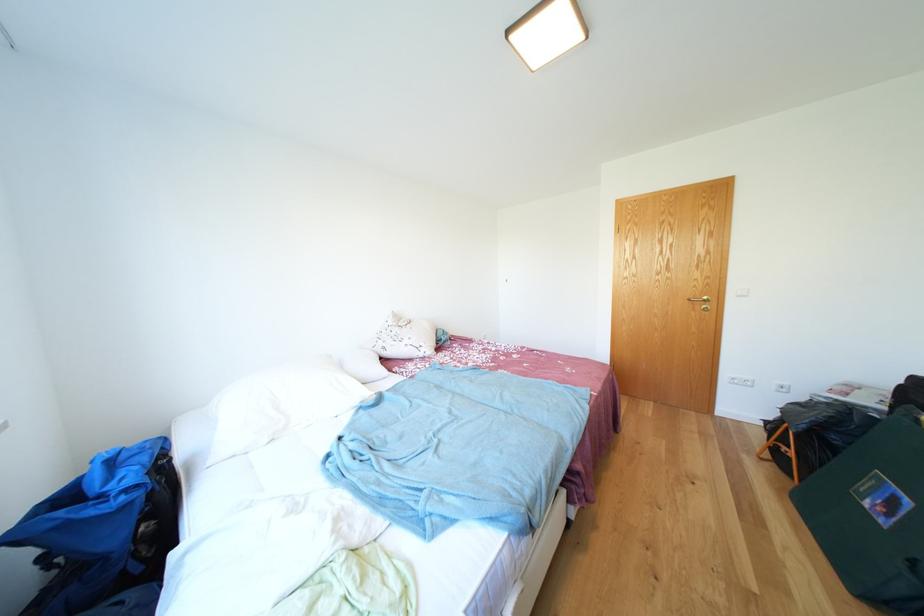
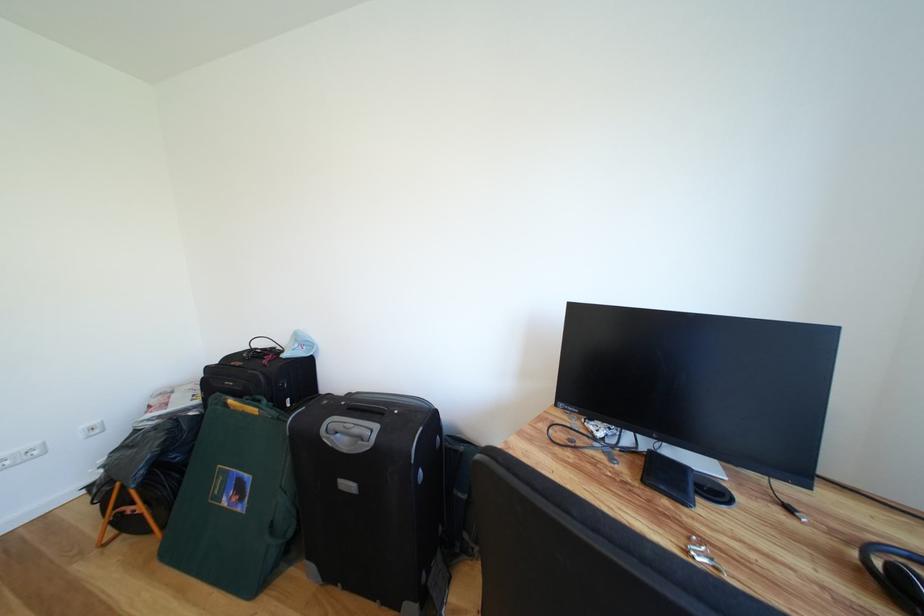
Question: The camera is either moving clockwise (left) or counter-clockwise (right) around the object. The first image is from the beginning of the video and the second image is from the end. Is the camera moving left or right when shooting the video?

Choices:
 (A) Left
 (B) Right

Answer: (A)